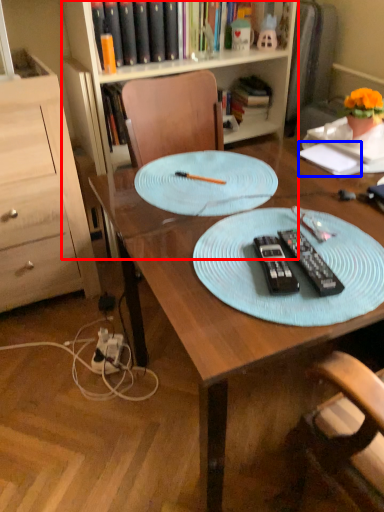
Question: Among these objects, which one is farthest to the camera, bookcase (highlighted by a red box) or notepad (highlighted by a blue box)?

Choices:
 (A) bookcase
 (B) notepad

Answer: (A)